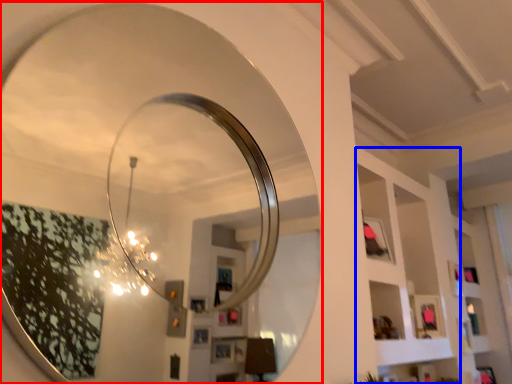
Question: Which point is closer to the camera, mirror (highlighted by a red box) or shelf (highlighted by a blue box)?

Choices:
 (A) mirror
 (B) shelf

Answer: (A)